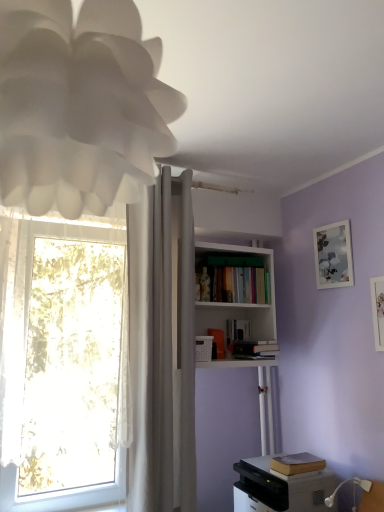
Question: From the image's perspective, is brown leather book at lower right, arranged as the fifth book when viewed from the top, on white sheer curtain at left?

Choices:
 (A) no
 (B) yes

Answer: (A)

Question: Is brown leather book at lower right, arranged as the fifth book when viewed from the top, bigger than white sheer curtain at left?

Choices:
 (A) yes
 (B) no

Answer: (B)

Question: Does brown leather book at lower right, arranged as the fifth book when viewed from the top, appear on the left side of white sheer curtain at left?

Choices:
 (A) no
 (B) yes

Answer: (A)

Question: Is brown leather book at lower right, arranged as the fifth book when viewed from the top, closer to the viewer compared to white sheer curtain at left?

Choices:
 (A) no
 (B) yes

Answer: (A)

Question: Can you confirm if brown leather book at lower right, the first book positioned from the bottom, is positioned to the right of white sheer curtain at left?

Choices:
 (A) no
 (B) yes

Answer: (B)

Question: From the image's perspective, is brown leather book at lower right, the first book positioned from the bottom, located beneath white sheer curtain at left?

Choices:
 (A) no
 (B) yes

Answer: (B)

Question: From the image's perspective, is white plastic remote control at upper center located beneath white matte bookcase at upper center?

Choices:
 (A) yes
 (B) no

Answer: (A)

Question: Does white plastic remote control at upper center have a greater height compared to white matte bookcase at upper center?

Choices:
 (A) yes
 (B) no

Answer: (B)

Question: Considering the relative positions of white plastic remote control at upper center and white matte bookcase at upper center in the image provided, is white plastic remote control at upper center in front of white matte bookcase at upper center?

Choices:
 (A) yes
 (B) no

Answer: (B)

Question: Can you confirm if white plastic remote control at upper center is thinner than white matte bookcase at upper center?

Choices:
 (A) no
 (B) yes

Answer: (B)

Question: Considering the relative positions of white plastic remote control at upper center and white matte bookcase at upper center in the image provided, is white plastic remote control at upper center to the right of white matte bookcase at upper center from the viewer's perspective?

Choices:
 (A) yes
 (B) no

Answer: (B)

Question: From the image's perspective, does white plastic remote control at upper center appear higher than white matte bookcase at upper center?

Choices:
 (A) yes
 (B) no

Answer: (B)

Question: Does white plastic remote control at upper center have a larger size compared to hardcover book at upper center, acting as the fourth book starting from the bottom?

Choices:
 (A) yes
 (B) no

Answer: (B)